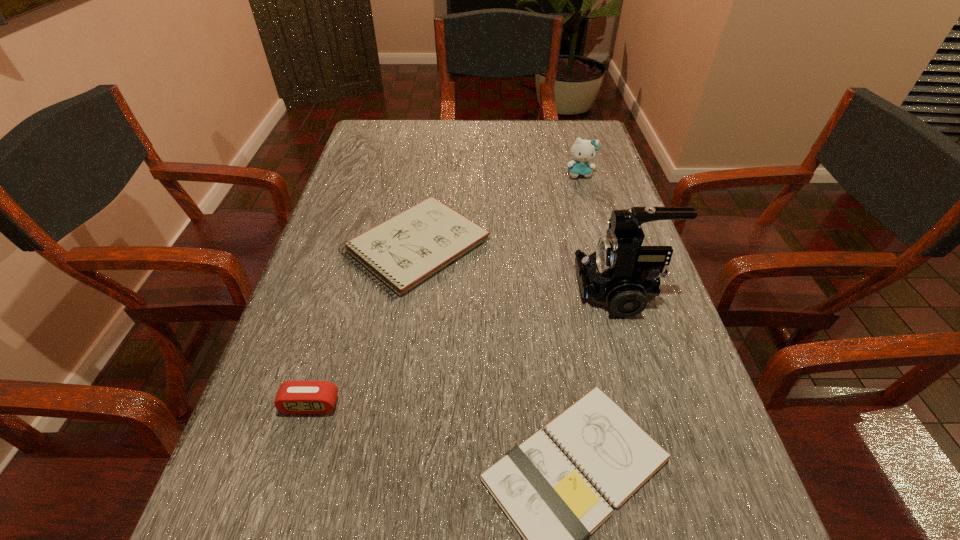
In the image, there is a desktop. Where is `vacant area at the far right corner`? vacant area at the far right corner is located at coordinates (581, 126).

Image resolution: width=960 pixels, height=540 pixels. Identify the location of free space between the fourth tallest object and the alarm clock. (364, 326).

Find the location of a particular element. vacant area between the second tallest object and the second shortest object is located at coordinates (498, 210).

The image size is (960, 540). In order to click on vacant area that lies between the third tallest object and the fourth shortest object in this screenshot , I will do `click(445, 289)`.

Identify the location of vacant area that lies between the farthest object and the third tallest object. (445, 289).

I want to click on vacant space that is in between the second tallest object and the tallest object, so click(600, 232).

You are a GUI agent. You are given a task and a screenshot of the screen. Output one action in this format:
    pyautogui.click(x=<x>, y=<y>)
    Task: Click on the free space between the second tallest object and the camcorder
    The width and height of the screenshot is (960, 540).
    Given the screenshot: What is the action you would take?
    pyautogui.click(x=600, y=232)

Locate an element on the screen. This screenshot has width=960, height=540. empty space between the farthest object and the camcorder is located at coordinates click(x=600, y=232).

In order to click on object that is the closest one to the farthest object in this screenshot , I will do `click(403, 251)`.

Point out which object is positioned as the fourth nearest to the alarm clock. Please provide its 2D coordinates. Your answer should be formatted as a tuple, i.e. [(x, y)], where the tuple contains the x and y coordinates of a point satisfying the conditions above.

[(583, 151)]